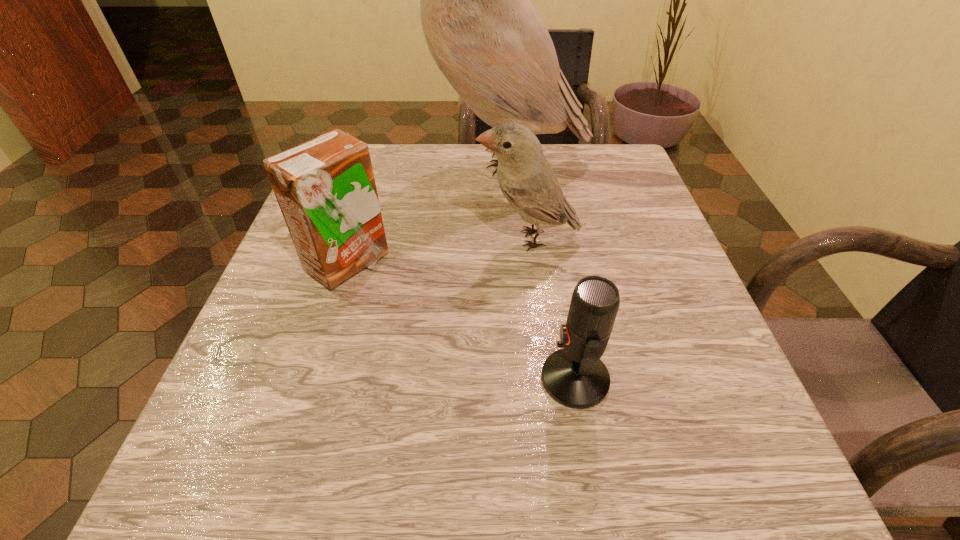
Locate an element on the screen. The image size is (960, 540). free region located at the face of the bird is located at coordinates (357, 239).

Image resolution: width=960 pixels, height=540 pixels. What are the coordinates of `vacant space located 0.070m at the face of the bird` in the screenshot? It's located at (440, 239).

The height and width of the screenshot is (540, 960). I want to click on blank space located 0.160m on the straw side of the carton, so click(x=476, y=264).

You are a GUI agent. You are given a task and a screenshot of the screen. Output one action in this format:
    pyautogui.click(x=<x>, y=<y>)
    Task: Click on the vacant space located 0.200m on the side of the shortest object with the red ring
    
    Given the screenshot: What is the action you would take?
    pyautogui.click(x=402, y=379)

What are the coordinates of `vacant space located 0.290m on the side of the shortest object with the red ring` in the screenshot? It's located at (339, 379).

Image resolution: width=960 pixels, height=540 pixels. In order to click on blank area located 0.240m on the side of the shortest object with the red ring in this screenshot , I will do `click(373, 379)`.

Locate an element on the screen. object present at the far edge is located at coordinates (486, 37).

The image size is (960, 540). Find the location of `object positioned at the left edge`. object positioned at the left edge is located at coordinates (325, 187).

You are a GUI agent. You are given a task and a screenshot of the screen. Output one action in this format:
    pyautogui.click(x=<x>, y=<y>)
    Task: Click on the object positioned at the right edge
    This screenshot has height=540, width=960.
    Given the screenshot: What is the action you would take?
    pyautogui.click(x=486, y=37)

Locate an element on the screen. object that is at the far right corner is located at coordinates (486, 37).